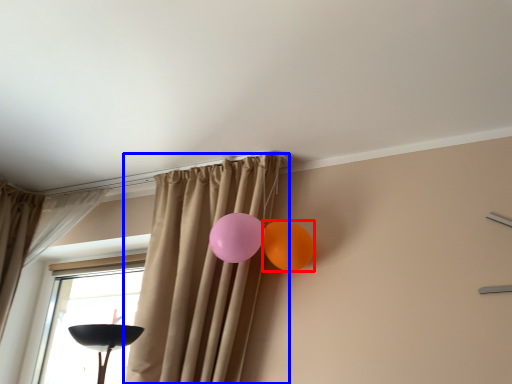
Question: Which object appears closest to the camera in this image, balloon (highlighted by a red box) or curtain (highlighted by a blue box)?

Choices:
 (A) balloon
 (B) curtain

Answer: (B)